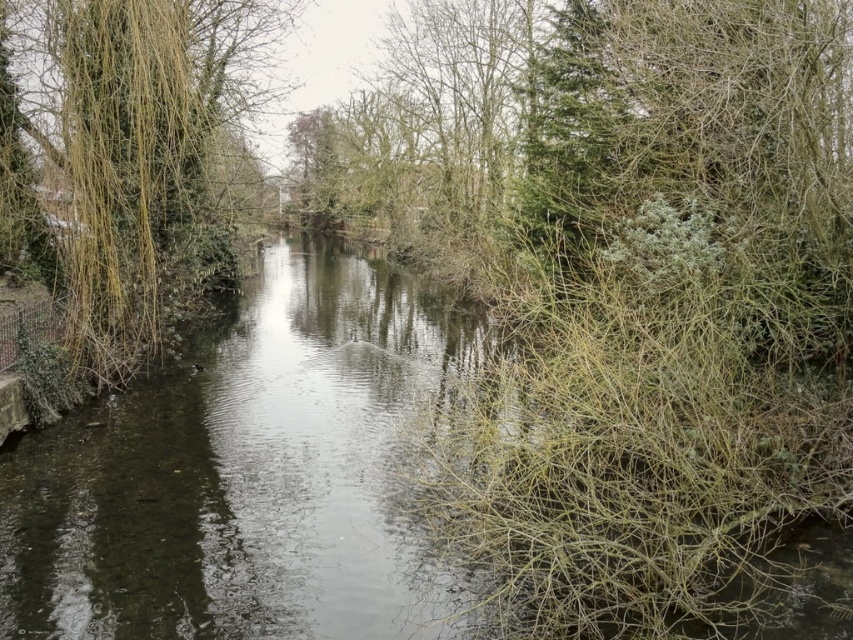
Question: Is clear water at center smaller than green leafy tree at left?

Choices:
 (A) yes
 (B) no

Answer: (B)

Question: Among these points, which one is farthest from the camera?

Choices:
 (A) (15, 148)
 (B) (195, 540)

Answer: (A)

Question: Is clear water at center thinner than green leafy tree at left?

Choices:
 (A) no
 (B) yes

Answer: (A)

Question: Is clear water at center further to the viewer compared to green leafy tree at left?

Choices:
 (A) yes
 (B) no

Answer: (B)

Question: Which point is closer to the camera?

Choices:
 (A) clear water at center
 (B) green leafy tree at left

Answer: (A)